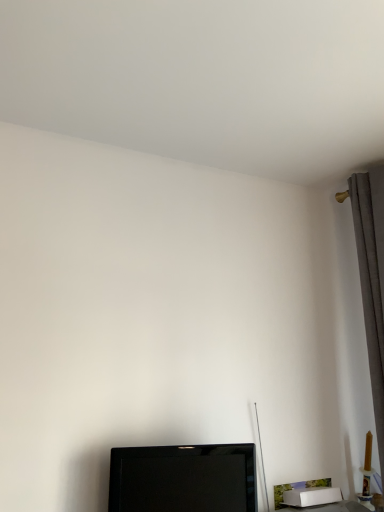
Question: Is black glossy tv at lower center in front of or behind gray fabric curtain at right in the image?

Choices:
 (A) front
 (B) behind

Answer: (A)

Question: From a real-world perspective, is black glossy tv at lower center physically located above or below gray fabric curtain at right?

Choices:
 (A) above
 (B) below

Answer: (B)

Question: From their relative heights in the image, would you say black glossy tv at lower center is taller or shorter than gray fabric curtain at right?

Choices:
 (A) tall
 (B) short

Answer: (B)

Question: From a real-world perspective, is gray fabric curtain at right positioned above or below black glossy tv at lower center?

Choices:
 (A) above
 (B) below

Answer: (A)

Question: In the image, is gray fabric curtain at right positioned in front of or behind black glossy tv at lower center?

Choices:
 (A) behind
 (B) front

Answer: (A)

Question: Is gray fabric curtain at right to the left or to the right of black glossy tv at lower center in the image?

Choices:
 (A) left
 (B) right

Answer: (B)

Question: Choose the correct answer: Is gray fabric curtain at right inside black glossy tv at lower center or outside it?

Choices:
 (A) inside
 (B) outside

Answer: (B)